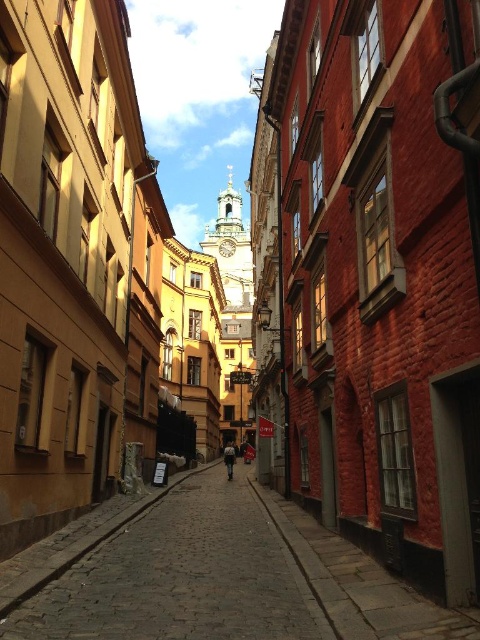
How distant is cobblestone alley at center from dark blue denim jacket at center?

cobblestone alley at center is 53.34 meters from dark blue denim jacket at center.

Locate an element on the screen. cobblestone alley at center is located at coordinates (210, 573).